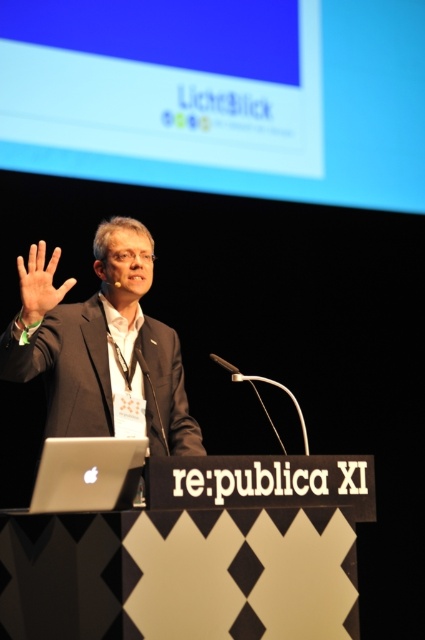
Question: Considering the real-world distances, which object is closest to the matte black hand at upper left?

Choices:
 (A) dark gray suit at center
 (B) blue matte screen at upper center
 (C) silver metallic laptop at lower left

Answer: (A)

Question: Is dark gray suit at center to the right of silver metallic laptop at lower left from the viewer's perspective?

Choices:
 (A) no
 (B) yes

Answer: (B)

Question: Is silver metallic laptop at lower left wider than matte black hand at upper left?

Choices:
 (A) yes
 (B) no

Answer: (A)

Question: Estimate the real-world distances between objects in this image. Which object is closer to the matte black hand at upper left?

Choices:
 (A) silver metallic laptop at lower left
 (B) dark gray suit at center
 (C) blue matte screen at upper center

Answer: (B)

Question: Based on their relative distances, which object is nearer to the blue matte screen at upper center?

Choices:
 (A) matte black hand at upper left
 (B) silver metallic laptop at lower left

Answer: (A)

Question: Can you confirm if blue matte screen at upper center is positioned below dark gray suit at center?

Choices:
 (A) yes
 (B) no

Answer: (B)